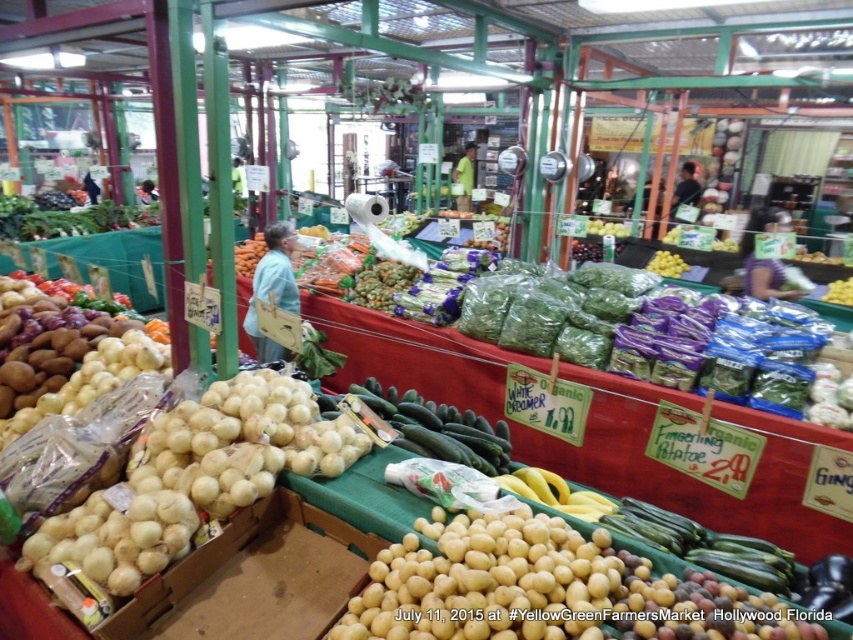
You are standing at the entrance of the YellowGreen Farmers Market and see the point marked at coordinates (438,428). What object is located at that point?

The point at coordinates (438,428) marks the green matte cucumber at center.